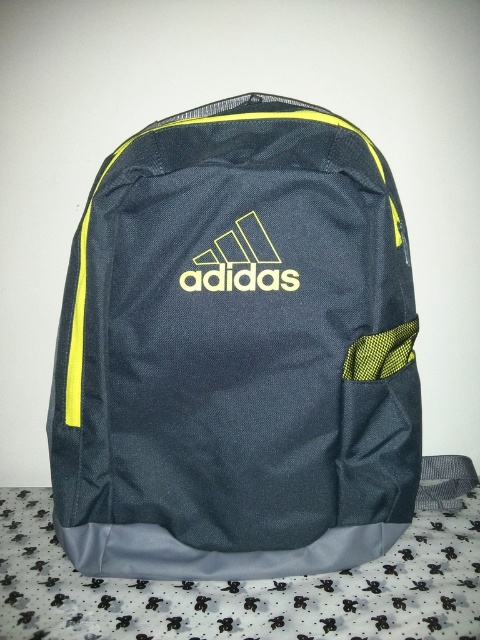
You are a graphic designer who needs to place a sticker on the backpack. The sticker is the same size as the yellow matte logo at center. Will the sticker fit entirely on the dark gray fabric backpack at center?

The dark gray fabric backpack at center is bigger than the yellow matte logo at center, so yes, the sticker will fit entirely on the dark gray fabric backpack at center since the backpack is larger than the logo.

You are standing 5 feet away from the dark gray fabric backpack at center. If you take two steps forward, each step being 2.5 feet, will you be closer than the distance specified in the description?

The dark gray fabric backpack at center is originally 3.37 feet away. After taking two steps forward totaling 5 feet, you would be 0.63 feet away, which is closer than the original distance.

You are examining the backpack and want to know if the yellow matte logo at center is visible from the front. Based on the scene description, can you determine if the logo is placed on the front panel of the dark gray fabric backpack at center?

The yellow matte logo at center is positioned centrally on the front panel of the dark gray fabric backpack at center, so yes, it is visible from the front.